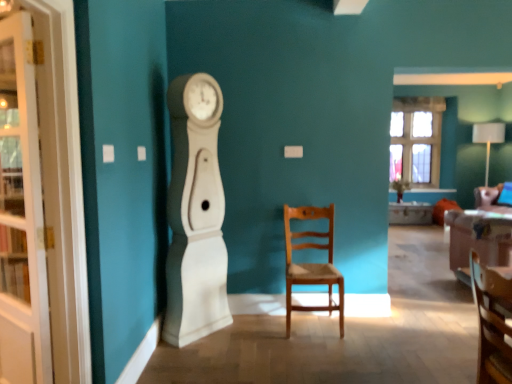
Question: Is the position of clear glass window at upper right more distant than that of wooden chair at center, the 2th chair when ordered from front to back?

Choices:
 (A) yes
 (B) no

Answer: (A)

Question: From a real-world perspective, is clear glass window at upper right under wooden chair at center, which appears as the 1th chair when viewed from the back?

Choices:
 (A) no
 (B) yes

Answer: (A)

Question: Could you tell me if clear glass window at upper right is turned towards wooden chair at center, marked as the first chair in a left-to-right arrangement?

Choices:
 (A) no
 (B) yes

Answer: (A)

Question: From a real-world perspective, does clear glass window at upper right stand above wooden chair at center, the 2th chair when ordered from front to back?

Choices:
 (A) yes
 (B) no

Answer: (A)

Question: Is clear glass window at upper right wider than wooden chair at center, which appears as the 1th chair when viewed from the back?

Choices:
 (A) no
 (B) yes

Answer: (A)

Question: Visually, is white glass cabinet at left positioned to the left or to the right of wooden chair at center, which appears as the 1th chair when viewed from the back?

Choices:
 (A) right
 (B) left

Answer: (B)

Question: Looking at their shapes, would you say white glass cabinet at left is wider or thinner than wooden chair at center, marked as the first chair in a left-to-right arrangement?

Choices:
 (A) wide
 (B) thin

Answer: (B)

Question: From the image's perspective, is white glass cabinet at left above or below wooden chair at center, marked as the first chair in a left-to-right arrangement?

Choices:
 (A) below
 (B) above

Answer: (B)

Question: From a real-world perspective, is white glass cabinet at left physically located above or below wooden chair at center, which is the second chair from right to left?

Choices:
 (A) below
 (B) above

Answer: (B)

Question: Would you say white glass cabinet at left is inside or outside clear glass window at upper right?

Choices:
 (A) inside
 (B) outside

Answer: (B)

Question: In terms of width, does white glass cabinet at left look wider or thinner when compared to clear glass window at upper right?

Choices:
 (A) wide
 (B) thin

Answer: (B)

Question: Is white glass cabinet at left taller or shorter than clear glass window at upper right?

Choices:
 (A) short
 (B) tall

Answer: (B)

Question: From the image's perspective, is white glass cabinet at left above or below clear glass window at upper right?

Choices:
 (A) above
 (B) below

Answer: (B)

Question: Is point (404, 142) positioned closer to the camera than point (481, 244)?

Choices:
 (A) farther
 (B) closer

Answer: (A)

Question: Which is correct: clear glass window at upper right is inside velvet pink couch at right, or outside of it?

Choices:
 (A) outside
 (B) inside

Answer: (A)